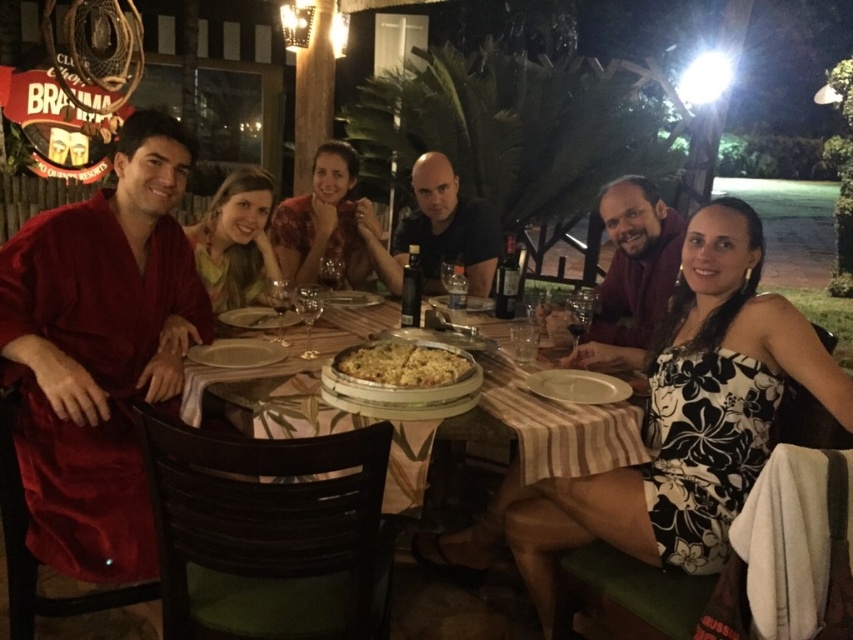
You are a waiter at this outdoor restaurant and need to deliver a drink to the guests. The drink should be placed between the matte yellow scarf at center and the golden crispy pizza at center. Since the scarf is to the left of the pizza, where should you place the drink relative to the pizza?

The drink should be placed to the left of the golden crispy pizza at center, as the matte yellow scarf at center is already located there.

You are a server at the restaurant and need to deliver a drink to the person wearing the matte red robe at left. The drink is currently placed on the white ceramic platter at lower center. Can you reach the platter without stepping over the table? Explain your reasoning.

The matte red robe at left and white ceramic platter at lower center are 1.07 meters apart. Since the distance between them is 1.07 meters, the server can easily reach the platter from the robe without needing to step over the table, as the distance is manageable for a server to stretch or move around the table to retrieve the drink.

You are a food delivery person who needs to place a small dessert plate between the matte yellow scarf at center and the golden crispy pizza at center. Since the scarf is larger than the pizza, will the dessert plate fit comfortably between them?

The matte yellow scarf at center has a larger size compared to golden crispy pizza at center, so placing a small dessert plate between them should be possible as there is enough space between the two items.